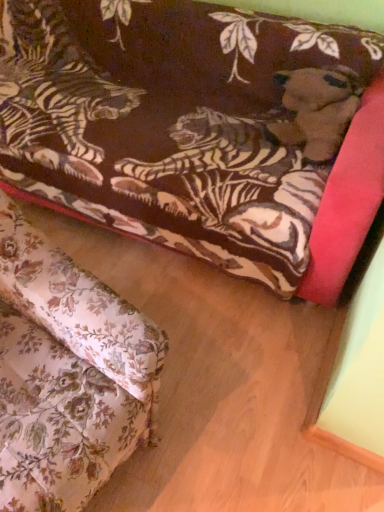
Describe the element at coordinates (66, 374) in the screenshot. This screenshot has height=512, width=384. I see `velvet tiger-patterned couch at upper center, which ranks as the first studio couch in front-to-back order` at that location.

This screenshot has width=384, height=512. In order to click on velvet tiger-patterned couch at upper center, arranged as the 2th studio couch when viewed from the back in this screenshot , I will do `click(66, 374)`.

The height and width of the screenshot is (512, 384). I want to click on velvet tiger-patterned couch at upper center, which is the second studio couch in front-to-back order, so click(193, 131).

Image resolution: width=384 pixels, height=512 pixels. What do you see at coordinates (193, 131) in the screenshot?
I see `velvet tiger-patterned couch at upper center, which is the second studio couch in front-to-back order` at bounding box center [193, 131].

Locate an element on the screen. velvet tiger-patterned couch at upper center, arranged as the 2th studio couch when viewed from the back is located at coordinates (66, 374).

Is velvet tiger-patterned couch at upper center, which is the second studio couch in front-to-back order, to the right of velvet tiger-patterned couch at upper center, arranged as the 2th studio couch when viewed from the back, from the viewer's perspective?

Yes.

Is velvet tiger-patterned couch at upper center, which is the second studio couch in front-to-back order, in front of or behind velvet tiger-patterned couch at upper center, which ranks as the first studio couch in front-to-back order, in the image?

velvet tiger-patterned couch at upper center, which is the second studio couch in front-to-back order, is behind velvet tiger-patterned couch at upper center, which ranks as the first studio couch in front-to-back order.

Considering the positions of points (39, 37) and (84, 432), is point (39, 37) farther from camera compared to point (84, 432)?

Yes.

From the image's perspective, which is below, velvet tiger-patterned couch at upper center, which is the second studio couch in front-to-back order, or velvet tiger-patterned couch at upper center, arranged as the 2th studio couch when viewed from the back?

velvet tiger-patterned couch at upper center, arranged as the 2th studio couch when viewed from the back, is shown below in the image.

From a real-world perspective, who is located higher, velvet tiger-patterned couch at upper center, which ranks as the first studio couch in back-to-front order, or velvet tiger-patterned couch at upper center, which ranks as the first studio couch in front-to-back order?

From a 3D spatial view, velvet tiger-patterned couch at upper center, which ranks as the first studio couch in front-to-back order, is above.

Between velvet tiger-patterned couch at upper center, which ranks as the first studio couch in back-to-front order, and velvet tiger-patterned couch at upper center, which ranks as the first studio couch in front-to-back order, which one has smaller width?

With smaller width is velvet tiger-patterned couch at upper center, which ranks as the first studio couch in front-to-back order.

Can you confirm if velvet tiger-patterned couch at upper center, which is the second studio couch in front-to-back order, is taller than velvet tiger-patterned couch at upper center, arranged as the 2th studio couch when viewed from the back?

In fact, velvet tiger-patterned couch at upper center, which is the second studio couch in front-to-back order, may be shorter than velvet tiger-patterned couch at upper center, arranged as the 2th studio couch when viewed from the back.

Who is smaller, velvet tiger-patterned couch at upper center, which is the second studio couch in front-to-back order, or velvet tiger-patterned couch at upper center, which ranks as the first studio couch in front-to-back order?

Smaller between the two is velvet tiger-patterned couch at upper center, which ranks as the first studio couch in front-to-back order.

Would you say velvet tiger-patterned couch at upper center, which ranks as the first studio couch in back-to-front order, is inside or outside velvet tiger-patterned couch at upper center, arranged as the 2th studio couch when viewed from the back?

velvet tiger-patterned couch at upper center, which ranks as the first studio couch in back-to-front order, is located beyond the bounds of velvet tiger-patterned couch at upper center, arranged as the 2th studio couch when viewed from the back.

Are velvet tiger-patterned couch at upper center, which ranks as the first studio couch in back-to-front order, and velvet tiger-patterned couch at upper center, which ranks as the first studio couch in front-to-back order, located far from each other?

No.

Is velvet tiger-patterned couch at upper center, which ranks as the first studio couch in back-to-front order, looking in the opposite direction of velvet tiger-patterned couch at upper center, arranged as the 2th studio couch when viewed from the back?

No, velvet tiger-patterned couch at upper center, which ranks as the first studio couch in back-to-front order,'s orientation is not away from velvet tiger-patterned couch at upper center, arranged as the 2th studio couch when viewed from the back.

How many degrees apart are the facing directions of velvet tiger-patterned couch at upper center, which ranks as the first studio couch in back-to-front order, and velvet tiger-patterned couch at upper center, arranged as the 2th studio couch when viewed from the back?

They differ by 79.7 degrees in their facing directions.

You are a GUI agent. You are given a task and a screenshot of the screen. Output one action in this format:
    pyautogui.click(x=<x>, y=<y>)
    Task: Click on the studio couch above the velvet tiger-patterned couch at upper center, arranged as the 2th studio couch when viewed from the back (from the image's perspective)
    
    Given the screenshot: What is the action you would take?
    pyautogui.click(x=193, y=131)

In the image, is velvet tiger-patterned couch at upper center, which ranks as the first studio couch in front-to-back order, on the left side or the right side of velvet tiger-patterned couch at upper center, which ranks as the first studio couch in back-to-front order?

In the image, velvet tiger-patterned couch at upper center, which ranks as the first studio couch in front-to-back order, appears on the left side of velvet tiger-patterned couch at upper center, which ranks as the first studio couch in back-to-front order.

Is velvet tiger-patterned couch at upper center, arranged as the 2th studio couch when viewed from the back, behind velvet tiger-patterned couch at upper center, which ranks as the first studio couch in back-to-front order?

That is False.

Is point (138, 422) positioned before point (324, 183)?

Yes, point (138, 422) is in front of point (324, 183).

From the image's perspective, which one is positioned lower, velvet tiger-patterned couch at upper center, which ranks as the first studio couch in front-to-back order, or velvet tiger-patterned couch at upper center, which is the second studio couch in front-to-back order?

velvet tiger-patterned couch at upper center, which ranks as the first studio couch in front-to-back order, from the image's perspective.

From a real-world perspective, is velvet tiger-patterned couch at upper center, arranged as the 2th studio couch when viewed from the back, on top of velvet tiger-patterned couch at upper center, which ranks as the first studio couch in back-to-front order?

Indeed, from a real-world perspective, velvet tiger-patterned couch at upper center, arranged as the 2th studio couch when viewed from the back, stands above velvet tiger-patterned couch at upper center, which ranks as the first studio couch in back-to-front order.

Between velvet tiger-patterned couch at upper center, which ranks as the first studio couch in front-to-back order, and velvet tiger-patterned couch at upper center, which is the second studio couch in front-to-back order, which one has smaller width?

With smaller width is velvet tiger-patterned couch at upper center, which ranks as the first studio couch in front-to-back order.

Consider the image. Who is shorter, velvet tiger-patterned couch at upper center, which ranks as the first studio couch in front-to-back order, or velvet tiger-patterned couch at upper center, which is the second studio couch in front-to-back order?

With less height is velvet tiger-patterned couch at upper center, which is the second studio couch in front-to-back order.

Considering the relative sizes of velvet tiger-patterned couch at upper center, arranged as the 2th studio couch when viewed from the back, and velvet tiger-patterned couch at upper center, which is the second studio couch in front-to-back order, in the image provided, is velvet tiger-patterned couch at upper center, arranged as the 2th studio couch when viewed from the back, smaller than velvet tiger-patterned couch at upper center, which is the second studio couch in front-to-back order,?

Correct, velvet tiger-patterned couch at upper center, arranged as the 2th studio couch when viewed from the back, occupies less space than velvet tiger-patterned couch at upper center, which is the second studio couch in front-to-back order.

Is velvet tiger-patterned couch at upper center, arranged as the 2th studio couch when viewed from the back, completely or partially outside of velvet tiger-patterned couch at upper center, which ranks as the first studio couch in back-to-front order?

velvet tiger-patterned couch at upper center, arranged as the 2th studio couch when viewed from the back, is positioned outside velvet tiger-patterned couch at upper center, which ranks as the first studio couch in back-to-front order.

Is velvet tiger-patterned couch at upper center, arranged as the 2th studio couch when viewed from the back, not near velvet tiger-patterned couch at upper center, which ranks as the first studio couch in back-to-front order?

velvet tiger-patterned couch at upper center, arranged as the 2th studio couch when viewed from the back, is actually quite close to velvet tiger-patterned couch at upper center, which ranks as the first studio couch in back-to-front order.

Could you tell me if velvet tiger-patterned couch at upper center, which ranks as the first studio couch in front-to-back order, is turned towards velvet tiger-patterned couch at upper center, which ranks as the first studio couch in back-to-front order?

No, velvet tiger-patterned couch at upper center, which ranks as the first studio couch in front-to-back order, is not aimed at velvet tiger-patterned couch at upper center, which ranks as the first studio couch in back-to-front order.

From the picture: How different are the orientations of velvet tiger-patterned couch at upper center, which ranks as the first studio couch in front-to-back order, and velvet tiger-patterned couch at upper center, which is the second studio couch in front-to-back order, in degrees?

The facing directions of velvet tiger-patterned couch at upper center, which ranks as the first studio couch in front-to-back order, and velvet tiger-patterned couch at upper center, which is the second studio couch in front-to-back order, are 79.7 degrees apart.

At what (x,y) coordinates should I click in order to perform the action: click on studio couch to the right of velvet tiger-patterned couch at upper center, arranged as the 2th studio couch when viewed from the back. Please return your answer as a coordinate pair (x, y). Looking at the image, I should click on (193, 131).

At what (x,y) coordinates should I click in order to perform the action: click on studio couch located below the velvet tiger-patterned couch at upper center, which ranks as the first studio couch in back-to-front order (from the image's perspective). Please return your answer as a coordinate pair (x, y). The height and width of the screenshot is (512, 384). Looking at the image, I should click on (66, 374).

Where is `studio couch located above the velvet tiger-patterned couch at upper center, arranged as the 2th studio couch when viewed from the back (from the image's perspective)`? studio couch located above the velvet tiger-patterned couch at upper center, arranged as the 2th studio couch when viewed from the back (from the image's perspective) is located at coordinates (193, 131).